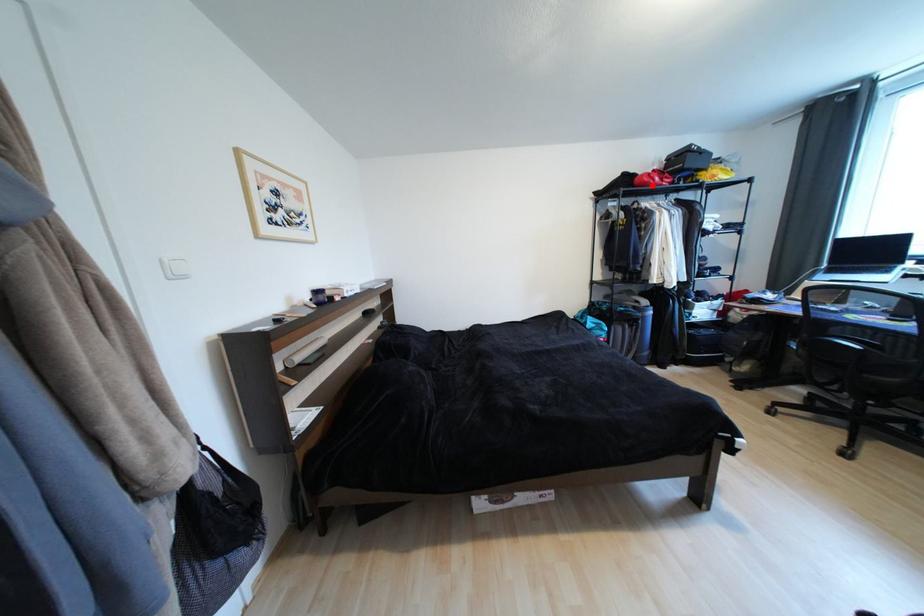
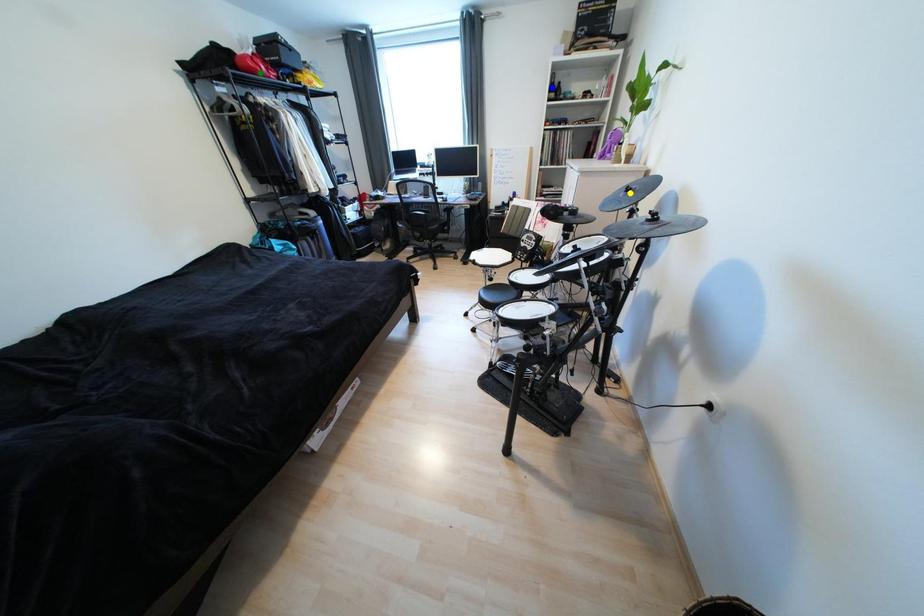
Question: I am providing you with two images of the same scene from different viewpoints. A red point is marked on the first image. You are given multiple points on the second image. Which spot in image 2 lines up with the point in image 1?

Choices:
 (A) blue point
 (B) yellow point
 (C) green point

Answer: (C)